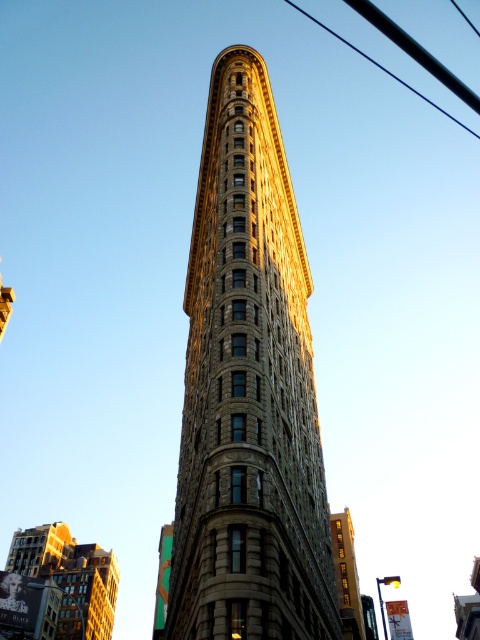
You are standing at the base of the Flatiron Building and notice two brown stone buildings in the foreground. Which one is positioned lower in the image, the brown stone building at lower left or the brown stone building at lower right?

The brown stone building at lower left is located below the brown stone building at lower right, so it is positioned lower in the image.

You are a city planner assessing the potential for a new streetlight installation. You notice the brown stone building at lower right and the black wire at upper right. Which object is closer to the ground level?

The brown stone building at lower right is shorter than the black wire at upper right, so the brown stone building at lower right is closer to the ground level.

You are standing on the sidewalk in front of the Flatiron Building and see the brown stone building at lower left and the brown stone building at lower right in the foreground. Which one is positioned more to the east if the sun is shining from the west?

The brown stone building at lower left is positioned more to the east since it is to the left of the brown stone building at lower right, and the sun is coming from the west.